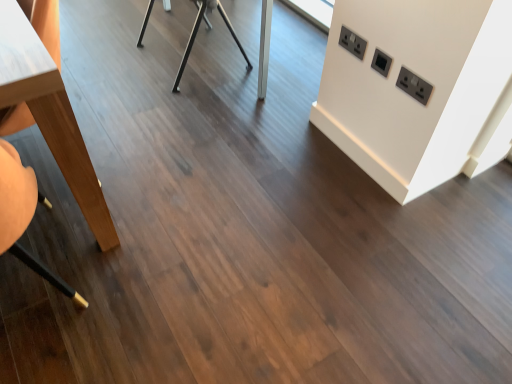
Identify the location of free region under wooden swivel chair at left (from a real-world perspective). The image size is (512, 384). (39, 310).